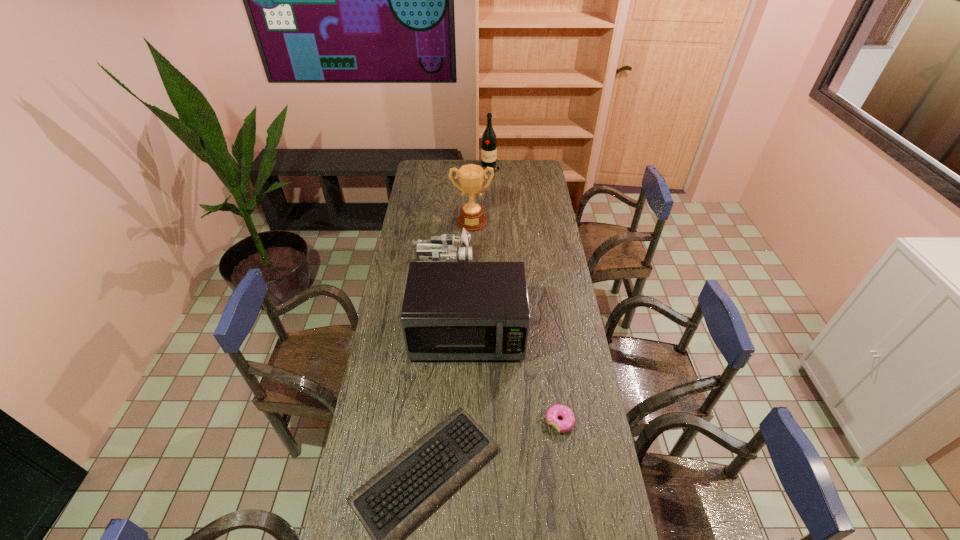
Image resolution: width=960 pixels, height=540 pixels. What are the coordinates of `wine bottle` in the screenshot? It's located at (489, 141).

This screenshot has height=540, width=960. Identify the location of the fifth nearest object. (471, 177).

Where is `the third tallest object`? the third tallest object is located at coordinates (451, 310).

Locate an element on the screen. the third nearest object is located at coordinates (451, 310).

The image size is (960, 540). What are the coordinates of `the third farthest object` in the screenshot? It's located at (442, 248).

Locate an element on the screen. The height and width of the screenshot is (540, 960). camcorder is located at coordinates (442, 248).

At what (x,y) coordinates should I click in order to perform the action: click on doughnut. Please return your answer as a coordinate pair (x, y). This screenshot has height=540, width=960. Looking at the image, I should click on [x=562, y=426].

Identify the location of free space located 0.050m on the surface of the wine bottle. (490, 177).

The height and width of the screenshot is (540, 960). In order to click on vacant space situated on the front-facing side of the award in this screenshot , I will do `click(470, 275)`.

In order to click on blank space located 0.110m on the front-facing side of the third nearest object in this screenshot , I will do `click(466, 394)`.